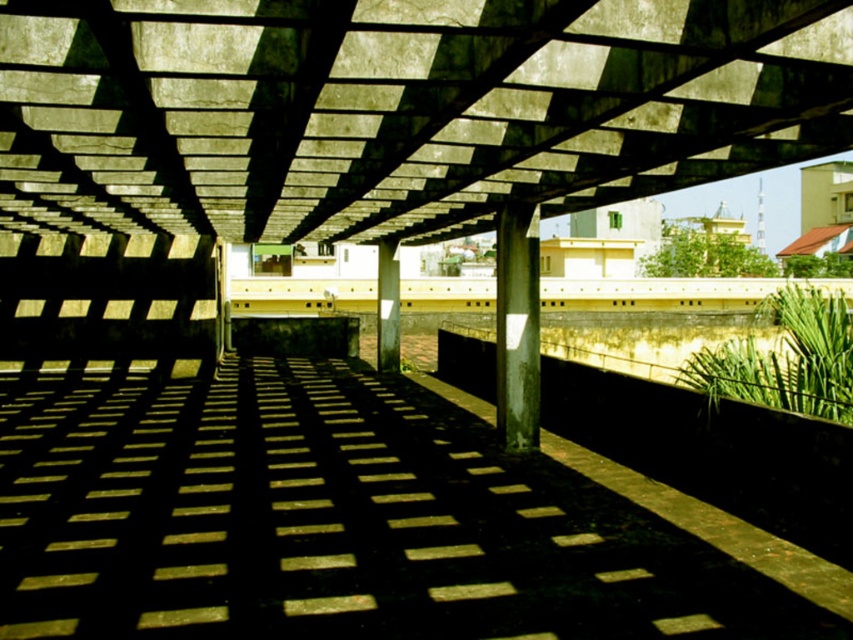
Can you confirm if smooth concrete path at center is positioned to the left of smooth concrete pillar at center?

Yes, smooth concrete path at center is to the left of smooth concrete pillar at center.

Is smooth concrete path at center taller than smooth concrete pillar at center?

Indeed, smooth concrete path at center has a greater height compared to smooth concrete pillar at center.

What do you see at coordinates (352, 522) in the screenshot?
I see `smooth concrete path at center` at bounding box center [352, 522].

Locate an element on the screen. Image resolution: width=853 pixels, height=640 pixels. smooth concrete path at center is located at coordinates (352, 522).

Does point (206, 515) lie in front of point (523, 218)?

Yes.

Which of these two, smooth concrete path at center or metallic gray column at center, stands shorter?

smooth concrete path at center

Is point (408, 564) farther from camera compared to point (506, 364)?

No, (408, 564) is closer to viewer.

You are a GUI agent. You are given a task and a screenshot of the screen. Output one action in this format:
    pyautogui.click(x=<x>, y=<y>)
    Task: Click on the smooth concrete path at center
    The height and width of the screenshot is (640, 853).
    Given the screenshot: What is the action you would take?
    pyautogui.click(x=352, y=522)

Who is higher up, concrete at center or metallic gray column at center?

concrete at center

Is concrete at center positioned before metallic gray column at center?

Yes, concrete at center is closer to the viewer.

Between point (59, 209) and point (529, 408), which one is positioned behind?

The point (59, 209) is behind.

I want to click on concrete at center, so 399,108.